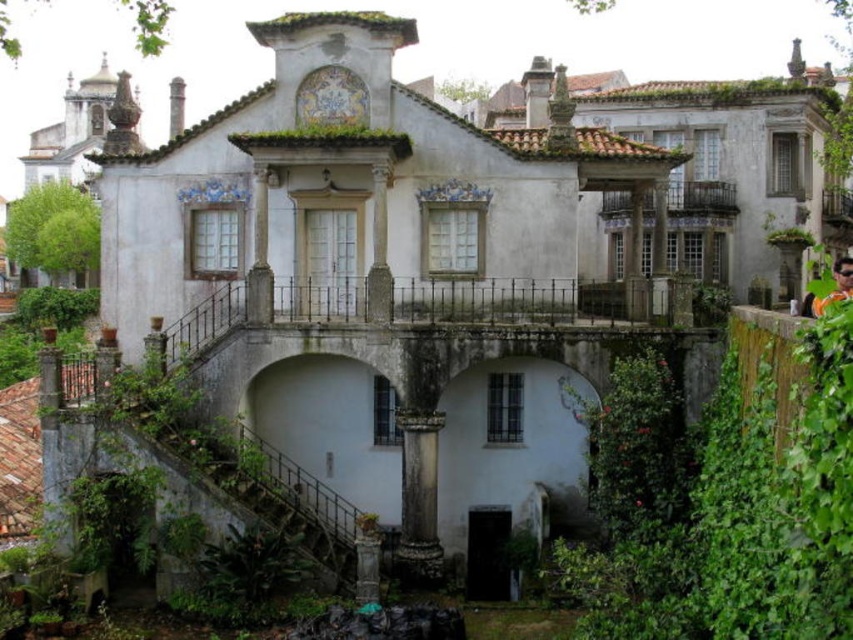
Is white painted wood balcony at upper right below wooden balcony at upper right?

Indeed, white painted wood balcony at upper right is positioned under wooden balcony at upper right.

Does point (647, 198) come in front of point (840, 208)?

Yes, point (647, 198) is closer to viewer.

The width and height of the screenshot is (853, 640). What are the coordinates of `white painted wood balcony at upper right` in the screenshot? It's located at (701, 196).

Where is `white stucco mansion at center`? This screenshot has height=640, width=853. white stucco mansion at center is located at coordinates (730, 164).

Is point (701, 216) more distant than point (850, 198)?

That is False.

Does white stucco mansion at center come in front of wooden balcony at upper right?

Yes.

What do you see at coordinates (730, 164) in the screenshot? The height and width of the screenshot is (640, 853). I see `white stucco mansion at center` at bounding box center [730, 164].

Identify the location of white stucco mansion at center. The height and width of the screenshot is (640, 853). click(730, 164).